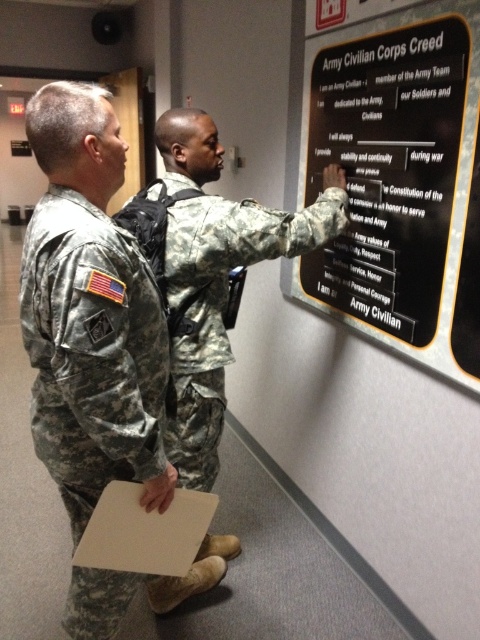
Question: Is camouflage fabric uniform at left below camouflage uniform at center?

Choices:
 (A) yes
 (B) no

Answer: (A)

Question: Observing the image, what is the correct spatial positioning of black matte sign at upper center in reference to camouflage fabric uniform at left?

Choices:
 (A) below
 (B) above

Answer: (B)

Question: Which object appears closest to the camera in this image?

Choices:
 (A) camouflage uniform at center
 (B) black matte sign at upper center
 (C) camouflage fabric uniform at left

Answer: (C)

Question: Which of the following is the farthest from the observer?

Choices:
 (A) (167, 332)
 (B) (468, 371)

Answer: (B)

Question: Is black matte sign at upper center smaller than camouflage uniform at center?

Choices:
 (A) no
 (B) yes

Answer: (A)

Question: Which object is farther from the camera taking this photo?

Choices:
 (A) camouflage fabric uniform at left
 (B) camouflage uniform at center

Answer: (B)